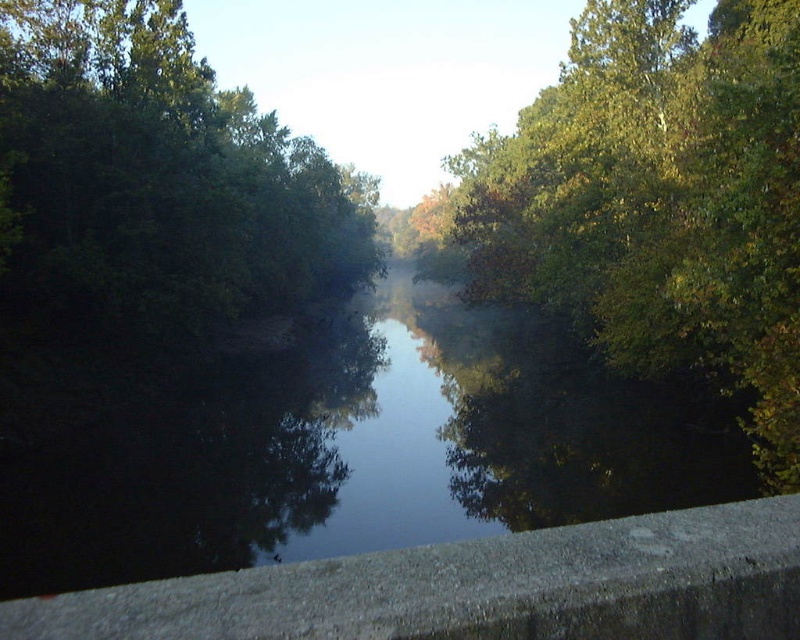
Question: Does dark reflective water at center appear over gray concrete ledge at lower center?

Choices:
 (A) no
 (B) yes

Answer: (B)

Question: Which point is closer to the camera?

Choices:
 (A) (268, 408)
 (B) (702, 262)
 (C) (252, 232)

Answer: (B)

Question: Which point appears farthest from the camera in this image?

Choices:
 (A) (192, 113)
 (B) (188, 388)
 (C) (458, 630)

Answer: (A)

Question: Which point is closer to the camera?

Choices:
 (A) dark reflective water at center
 (B) green leafy tree at upper right

Answer: (B)

Question: Can you confirm if green leafy tree at upper right is positioned to the right of gray concrete ledge at lower center?

Choices:
 (A) no
 (B) yes

Answer: (B)

Question: Is green leafy tree at upper right positioned before green leafy tree at left?

Choices:
 (A) yes
 (B) no

Answer: (A)